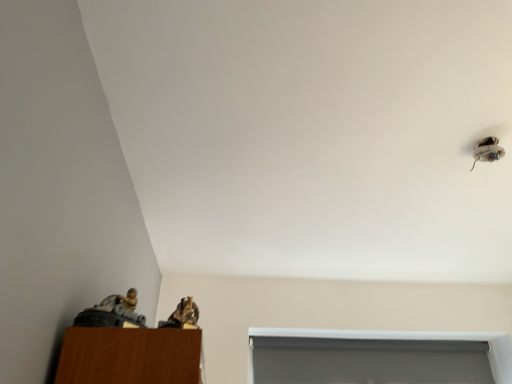
Question: Is white glossy shoe at upper right in front of or behind white matte window at lower center in the image?

Choices:
 (A) behind
 (B) front

Answer: (B)

Question: From the image's perspective, relative to white matte window at lower center, is white glossy shoe at upper right above or below?

Choices:
 (A) below
 (B) above

Answer: (B)

Question: Estimate the real-world distances between objects in this image. Which object is farther from the white matte window at lower center?

Choices:
 (A) white glossy shoe at upper right
 (B) brown textured figurine at lower left

Answer: (B)

Question: Based on their relative distances, which object is farther from the white matte window at lower center?

Choices:
 (A) brown textured figurine at lower left
 (B) white glossy shoe at upper right

Answer: (A)